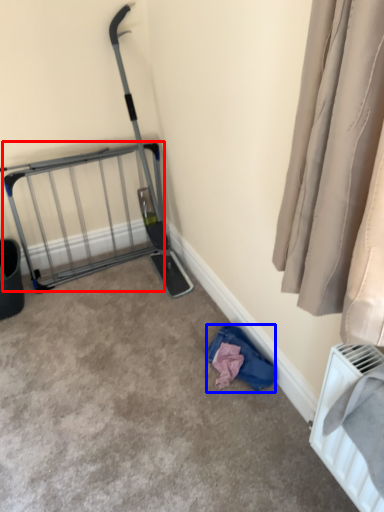
Question: Among these objects, which one is farthest to the camera, cage (highlighted by a red box) or clothing (highlighted by a blue box)?

Choices:
 (A) cage
 (B) clothing

Answer: (A)